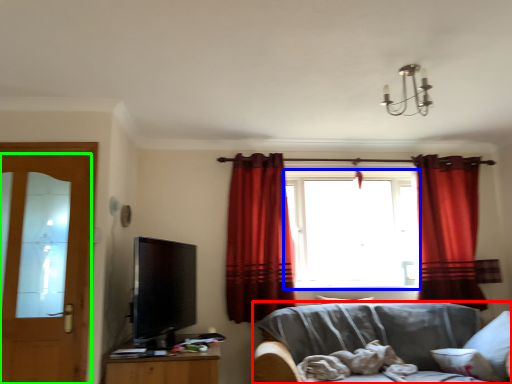
Question: Which object is the closest to the studio couch (highlighted by a red box)? Choose among these: window (highlighted by a blue box) or door (highlighted by a green box).

Choices:
 (A) window
 (B) door

Answer: (A)